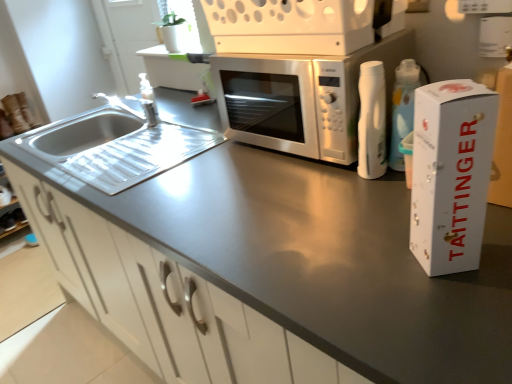
Locate an element on the screen. Image resolution: width=512 pixels, height=384 pixels. vacant space situated on the left part of white cardboard box at right is located at coordinates (361, 274).